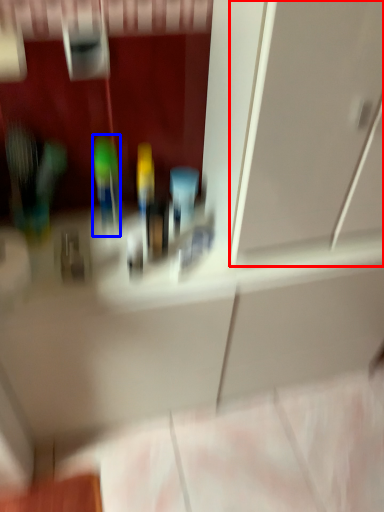
Question: Which of the following is the closest to the observer, glass door (highlighted by a red box) or toiletry (highlighted by a blue box)?

Choices:
 (A) glass door
 (B) toiletry

Answer: (A)